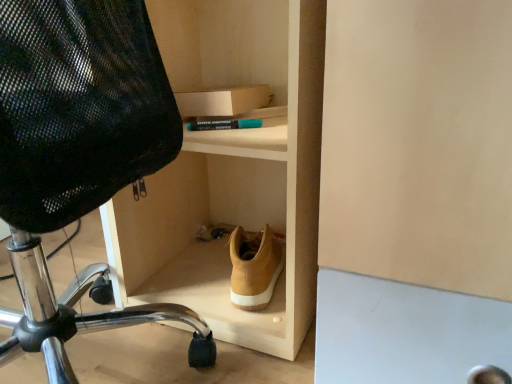
Question: Looking at the image, does tan suede shoe at center seem bigger or smaller compared to light wood shoe at lower center?

Choices:
 (A) small
 (B) big

Answer: (A)

Question: Would you say tan suede shoe at center is to the left or to the right of light wood shoe at lower center in the picture?

Choices:
 (A) left
 (B) right

Answer: (B)

Question: Which of these objects is positioned farthest from the light wood shoe at lower center?

Choices:
 (A) black mesh chair at left
 (B) tan suede shoe at center

Answer: (A)

Question: Which is nearer to the light wood shoe at lower center?

Choices:
 (A) tan suede shoe at center
 (B) black mesh chair at left

Answer: (A)